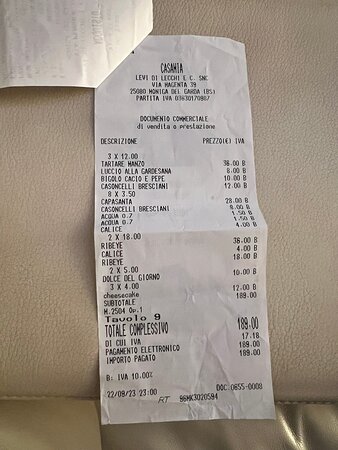
You are a GUI agent. You are given a task and a screenshot of the screen. Output one action in this format:
    pyautogui.click(x=<x>, y=<y>)
    Task: Click on the couch
    Image resolution: width=338 pixels, height=450 pixels.
    Given the screenshot: What is the action you would take?
    pyautogui.click(x=33, y=321)